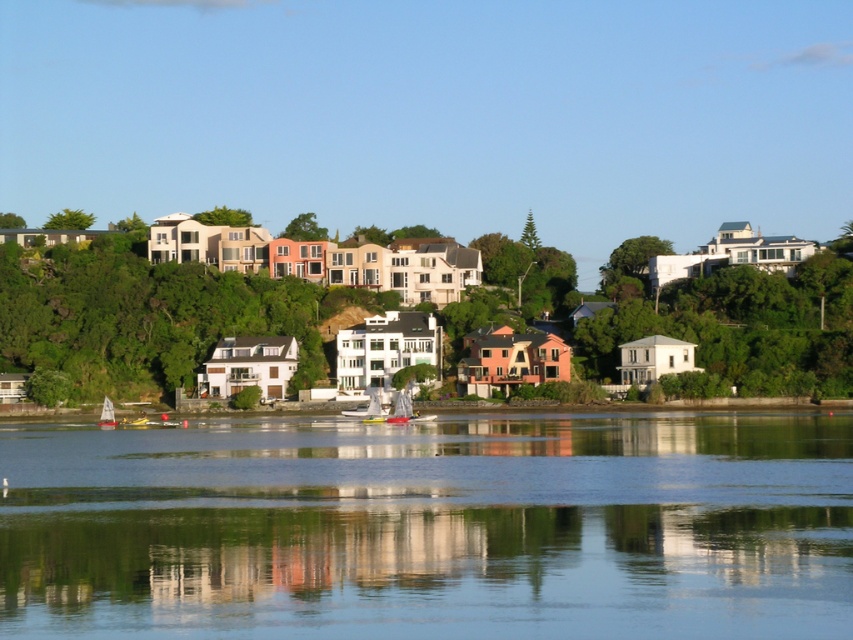
Question: Does clear water at center have a smaller size compared to smooth concrete shoreline at lower center?

Choices:
 (A) yes
 (B) no

Answer: (B)

Question: Which point is closer to the camera?

Choices:
 (A) (618, 621)
 (B) (190, 403)

Answer: (A)

Question: Is clear water at center in front of yellow matte sailboat at lower left?

Choices:
 (A) no
 (B) yes

Answer: (B)

Question: Observing the image, what is the correct spatial positioning of clear water at center in reference to smooth concrete shoreline at lower center?

Choices:
 (A) right
 (B) left

Answer: (A)

Question: Which point appears farthest from the camera in this image?

Choices:
 (A) (529, 580)
 (B) (105, 422)

Answer: (B)

Question: Estimate the real-world distances between objects in this image. Which object is closer to the smooth concrete shoreline at lower center?

Choices:
 (A) yellow matte sailboat at lower left
 (B) clear water at center

Answer: (A)